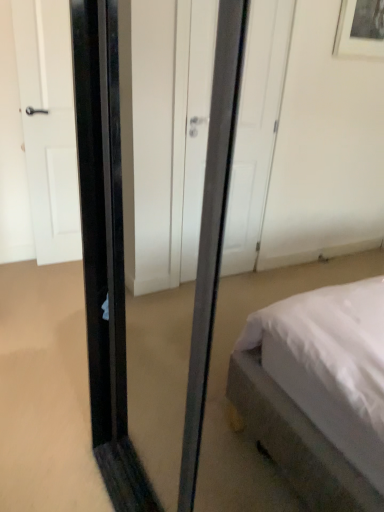
You are a GUI agent. You are given a task and a screenshot of the screen. Output one action in this format:
    pyautogui.click(x=<x>, y=<y>)
    Task: Click on the free spot in front of white matte door at left
    
    Given the screenshot: What is the action you would take?
    pyautogui.click(x=56, y=292)